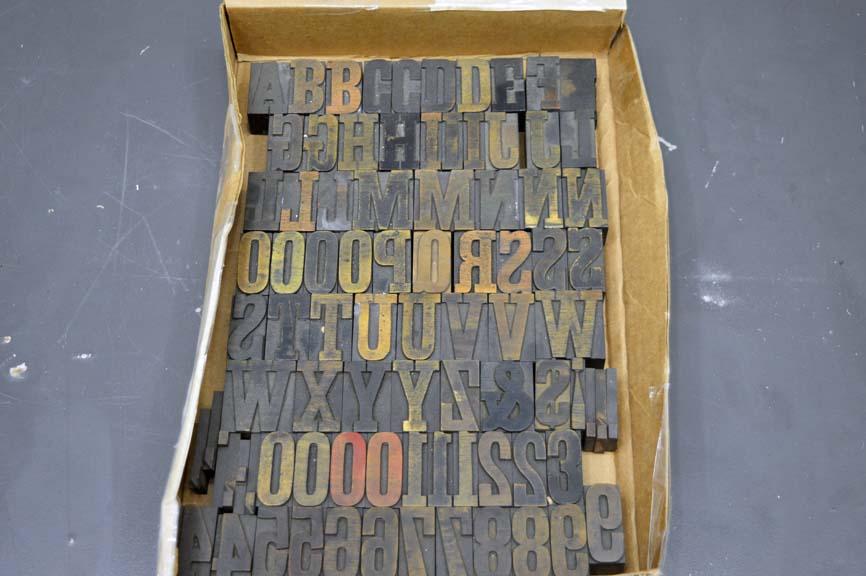
You are a GUI agent. You are given a task and a screenshot of the screen. Output one action in this format:
    pyautogui.click(x=<x>, y=<y>)
    Task: Click on the surface
    This screenshot has width=866, height=576.
    Given the screenshot: What is the action you would take?
    pyautogui.click(x=159, y=253)